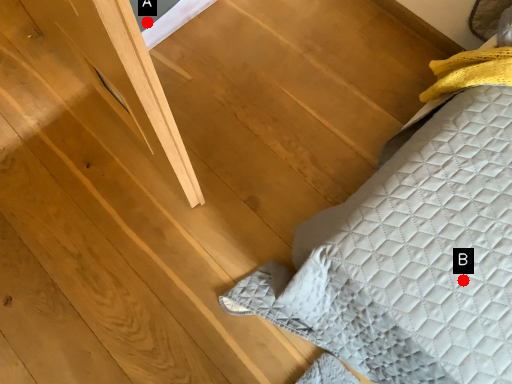
Question: Two points are circled on the image, labeled by A and B beside each circle. Which point appears closest to the camera in this image?

Choices:
 (A) A is closer
 (B) B is closer

Answer: (B)